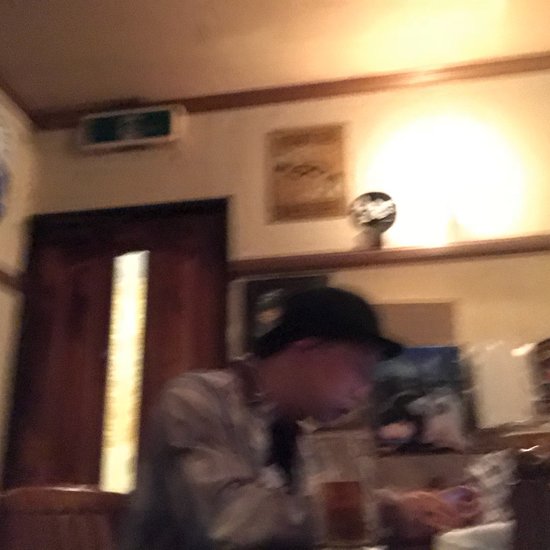
Identify the location of window in door. This screenshot has width=550, height=550. (124, 348).